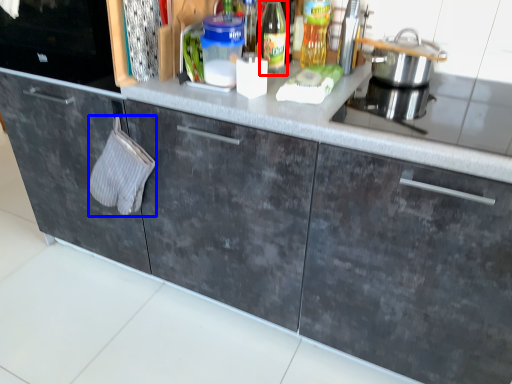
Question: Which of the following is the farthest to the observer, bottle (highlighted by a red box) or hand towel (highlighted by a blue box)?

Choices:
 (A) bottle
 (B) hand towel

Answer: (B)